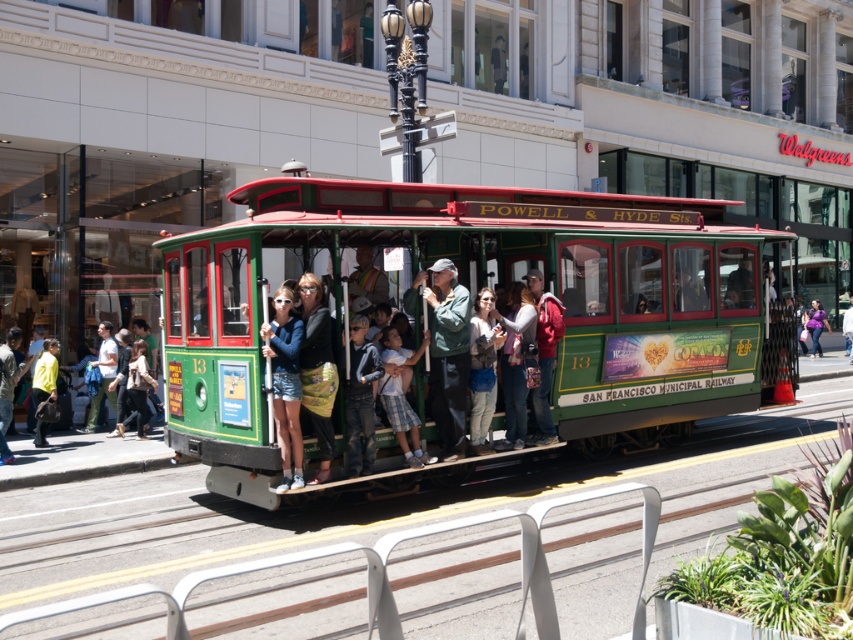
Question: Is green polished wood cable car at center in front of green fabric coach at center?

Choices:
 (A) no
 (B) yes

Answer: (A)

Question: Which point appears farthest from the camera in this image?

Choices:
 (A) (811, 342)
 (B) (291, 387)
 (C) (202, 243)
 (D) (442, 262)

Answer: (A)

Question: In this image, where is matte blue jacket at center located relative to purple fabric bag at lower right?

Choices:
 (A) left
 (B) right

Answer: (A)

Question: Which object is closer to the camera taking this photo?

Choices:
 (A) green polished wood cable car at center
 (B) purple fabric bag at lower right
 (C) matte blue jacket at center

Answer: (C)

Question: Which of the following is the closest to the observer?

Choices:
 (A) (447, 442)
 (B) (821, 321)

Answer: (A)

Question: Considering the relative positions of green polished wood cable car at center and matte blue jacket at center in the image provided, where is green polished wood cable car at center located with respect to matte blue jacket at center?

Choices:
 (A) above
 (B) below

Answer: (A)